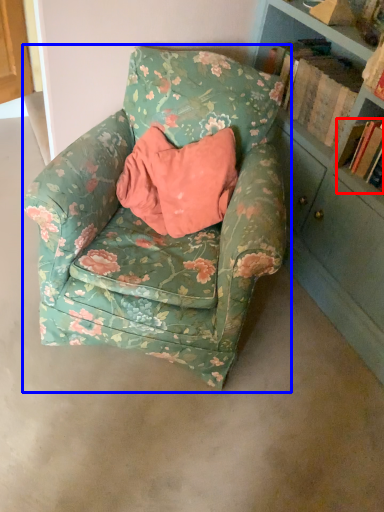
Question: Which object is further to the camera taking this photo, book (highlighted by a red box) or chair (highlighted by a blue box)?

Choices:
 (A) book
 (B) chair

Answer: (A)